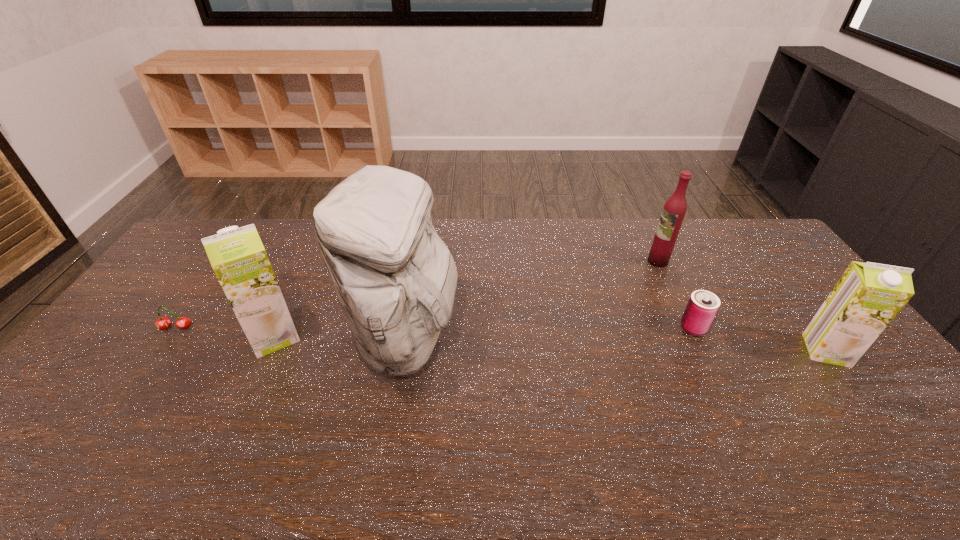
Locate an element on the screen. Image resolution: width=960 pixels, height=540 pixels. object that is at the left edge is located at coordinates (162, 323).

Where is `object that is at the right edge`? The height and width of the screenshot is (540, 960). object that is at the right edge is located at coordinates (868, 296).

The height and width of the screenshot is (540, 960). I want to click on free location at the far edge of the desktop, so click(465, 225).

The image size is (960, 540). What are the coordinates of `vacant space at the near edge of the desktop` in the screenshot? It's located at (607, 415).

This screenshot has height=540, width=960. I want to click on vacant space at the left edge of the desktop, so click(168, 289).

This screenshot has width=960, height=540. I want to click on free region at the right edge of the desktop, so click(884, 382).

Locate an element on the screen. The width and height of the screenshot is (960, 540). vacant space at the far right corner of the desktop is located at coordinates (775, 257).

The height and width of the screenshot is (540, 960). In order to click on unoccupied position between the leftmost object and the second object from left to right in this screenshot , I will do `click(225, 332)`.

In order to click on free spot between the third object from left to right and the fifth object from right to left in this screenshot , I will do `click(341, 338)`.

The height and width of the screenshot is (540, 960). Identify the location of free space between the leftmost object and the right soya milk. (501, 340).